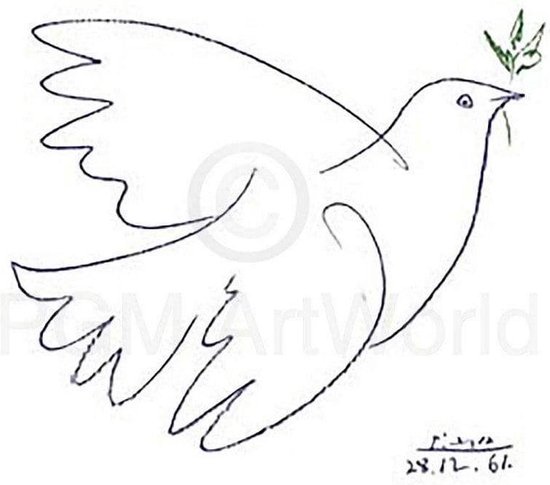
Where is `chest`? The image size is (550, 485). chest is located at coordinates (437, 222).